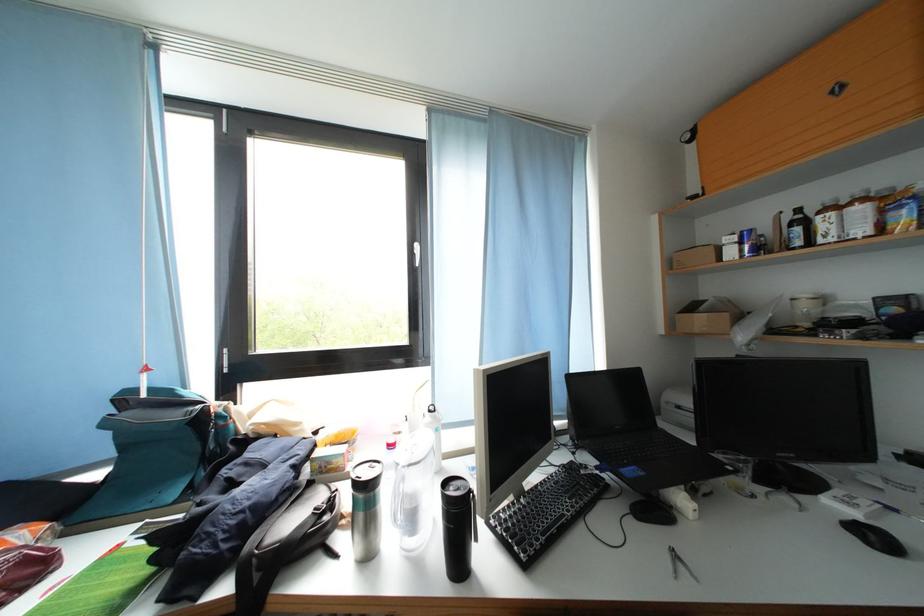
What do you see at coordinates (143, 379) in the screenshot? The width and height of the screenshot is (924, 616). I see `the red curtain handle` at bounding box center [143, 379].